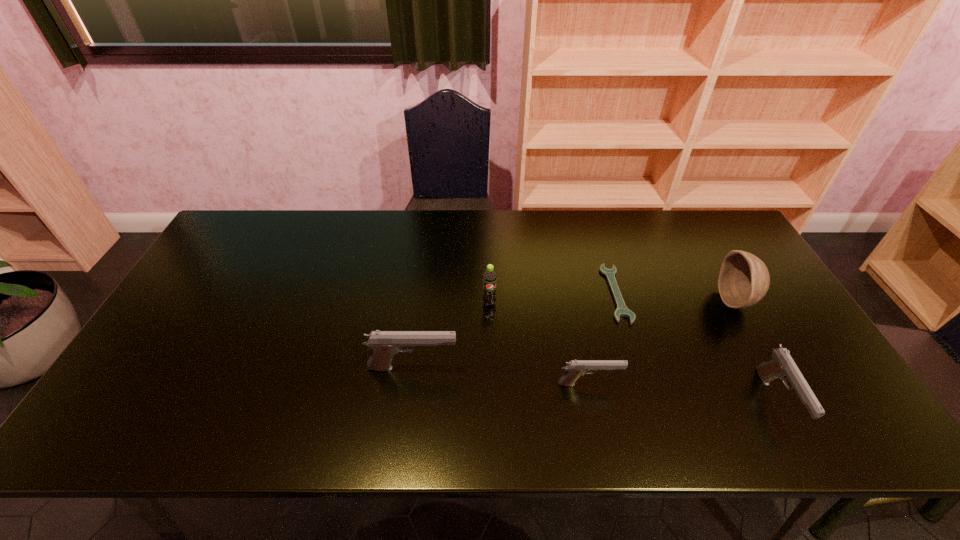
Identify the location of the leftmost object. This screenshot has height=540, width=960. (385, 344).

I want to click on the tallest pistol, so click(x=385, y=344).

The image size is (960, 540). Identify the location of the fourth object from right to left. (575, 368).

The width and height of the screenshot is (960, 540). In order to click on the fifth tallest object in this screenshot , I will do `click(575, 368)`.

Locate an element on the screen. the second tallest pistol is located at coordinates (782, 366).

Identify the location of the rightmost pistol. (782, 366).

Where is `bowl`? bowl is located at coordinates (744, 279).

The image size is (960, 540). Find the location of `the second object from left to right`. the second object from left to right is located at coordinates (489, 277).

I want to click on the third object from right to left, so click(x=622, y=310).

Where is `the shortest object`? The image size is (960, 540). the shortest object is located at coordinates (622, 310).